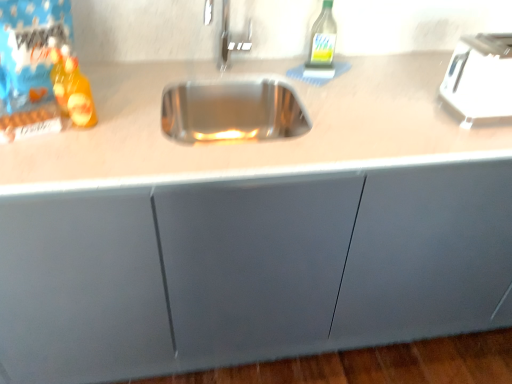
Identify the location of vacant area that lies between white plastic toaster at upper right and translucent plastic bottle at left, which is the 1th bottle from left to right. The height and width of the screenshot is (384, 512). (323, 119).